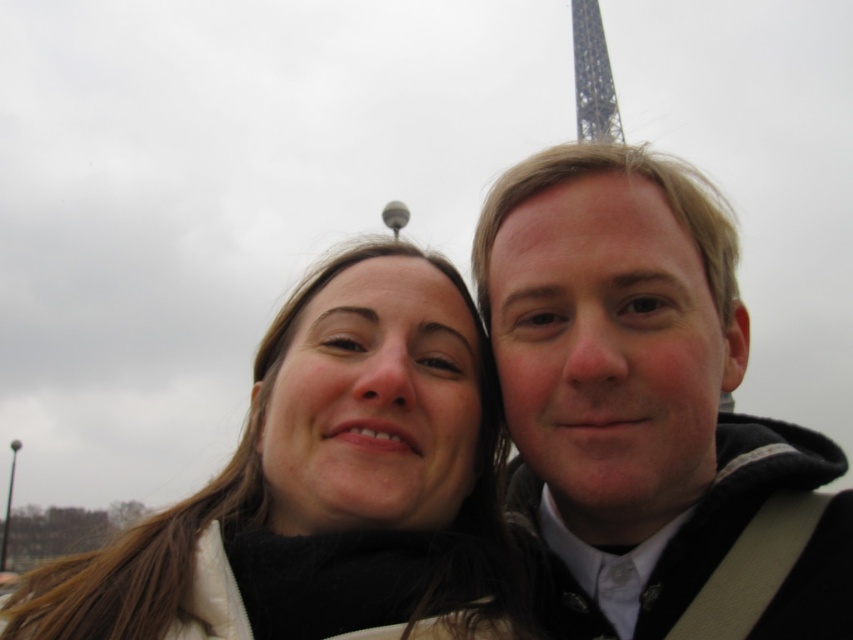
Can you confirm if matte black jacket at center is thinner than metallic lattice structure at upper center?

No, matte black jacket at center is not thinner than metallic lattice structure at upper center.

Who is higher up, matte black jacket at center or metallic lattice structure at upper center?

metallic lattice structure at upper center

Which is behind, point (132, 596) or point (583, 52)?

The point (583, 52) is more distant.

I want to click on matte black jacket at center, so click(x=326, y=486).

Is smooth black jacket at right to the left of metallic lattice structure at upper center from the viewer's perspective?

Indeed, smooth black jacket at right is positioned on the left side of metallic lattice structure at upper center.

Which of these two, smooth black jacket at right or metallic lattice structure at upper center, stands taller?

With more height is smooth black jacket at right.

Locate an element on the screen. Image resolution: width=853 pixels, height=640 pixels. smooth black jacket at right is located at coordinates (647, 406).

Between point (711, 458) and point (215, 548), which one is positioned in front?

Point (215, 548)

Who is positioned more to the right, smooth black jacket at right or matte black jacket at center?

smooth black jacket at right

Between point (786, 552) and point (354, 353), which one is positioned behind?

Point (354, 353)

Identify the location of smooth black jacket at right. The image size is (853, 640). (647, 406).